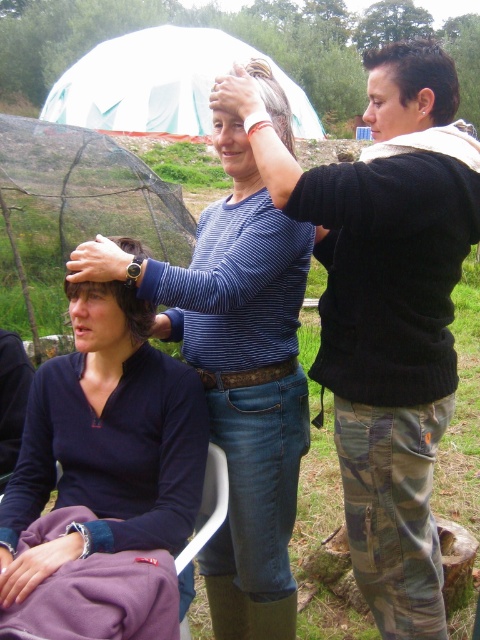
Question: Which object appears farthest from the camera in this image?

Choices:
 (A) dark blue fabric at center
 (B) blue striped shirt at center

Answer: (B)

Question: Is white fabric tent at upper center further to the viewer compared to purple fabric folding chair at lower left?

Choices:
 (A) no
 (B) yes

Answer: (B)

Question: Where is dark blue fabric at center located in relation to white fabric tent at upper center in the image?

Choices:
 (A) left
 (B) right

Answer: (B)

Question: Does blue striped shirt at center come in front of purple fabric folding chair at lower left?

Choices:
 (A) yes
 (B) no

Answer: (B)

Question: Which object appears farthest from the camera in this image?

Choices:
 (A) blue striped shirt at center
 (B) blue striped sweater at upper center
 (C) white fabric tent at upper center
 (D) purple fabric folding chair at lower left

Answer: (C)

Question: Which object appears closest to the camera in this image?

Choices:
 (A) purple fabric folding chair at lower left
 (B) white fabric tent at upper center
 (C) blue striped sweater at upper center

Answer: (A)